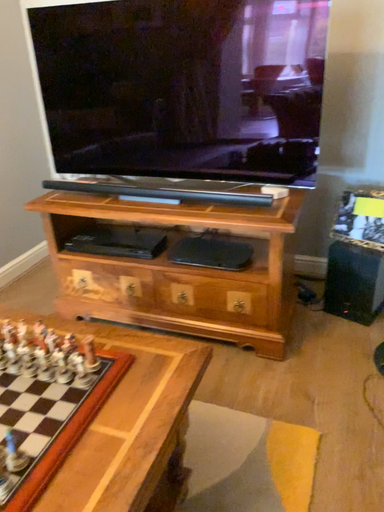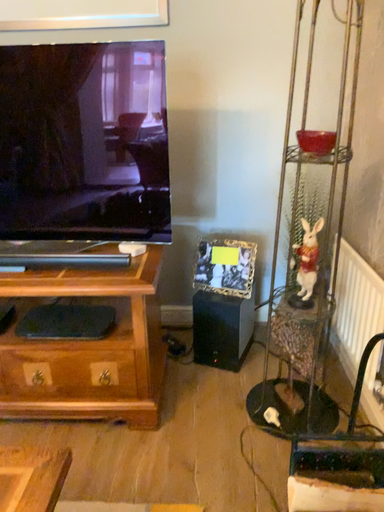
Question: How did the camera likely rotate when shooting the video?

Choices:
 (A) rotated upward
 (B) rotated downward

Answer: (A)